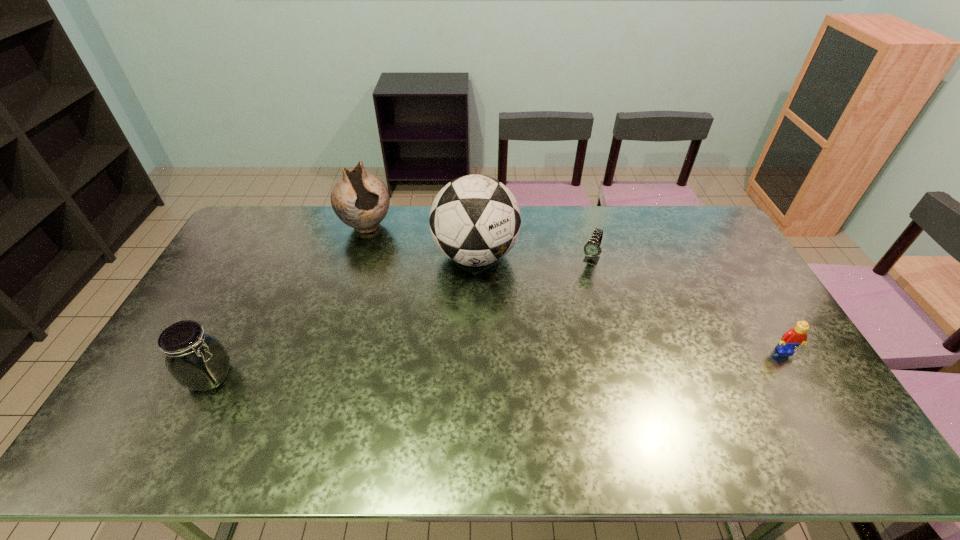
Identify the location of object present at the near edge. The image size is (960, 540). (197, 361).

Locate an element on the screen. The height and width of the screenshot is (540, 960). object at the left edge is located at coordinates (197, 361).

Find the location of a particular element. object present at the right edge is located at coordinates (795, 336).

Locate an element on the screen. This screenshot has height=540, width=960. object situated at the near left corner is located at coordinates (197, 361).

In the image, there is a desktop. In order to click on vacant space at the far edge in this screenshot , I will do `click(614, 229)`.

At what (x,y) coordinates should I click in order to perform the action: click on free space at the near edge of the desktop. Please return your answer as a coordinate pair (x, y). The width and height of the screenshot is (960, 540). Looking at the image, I should click on (260, 393).

Where is `free space at the left edge`? Image resolution: width=960 pixels, height=540 pixels. free space at the left edge is located at coordinates (222, 278).

Image resolution: width=960 pixels, height=540 pixels. In order to click on free space at the right edge in this screenshot , I will do `click(735, 288)`.

Where is `blank region between the rightmost object and the watch`? blank region between the rightmost object and the watch is located at coordinates (687, 305).

Locate an element on the screen. free space between the rightmost object and the jar is located at coordinates (497, 363).